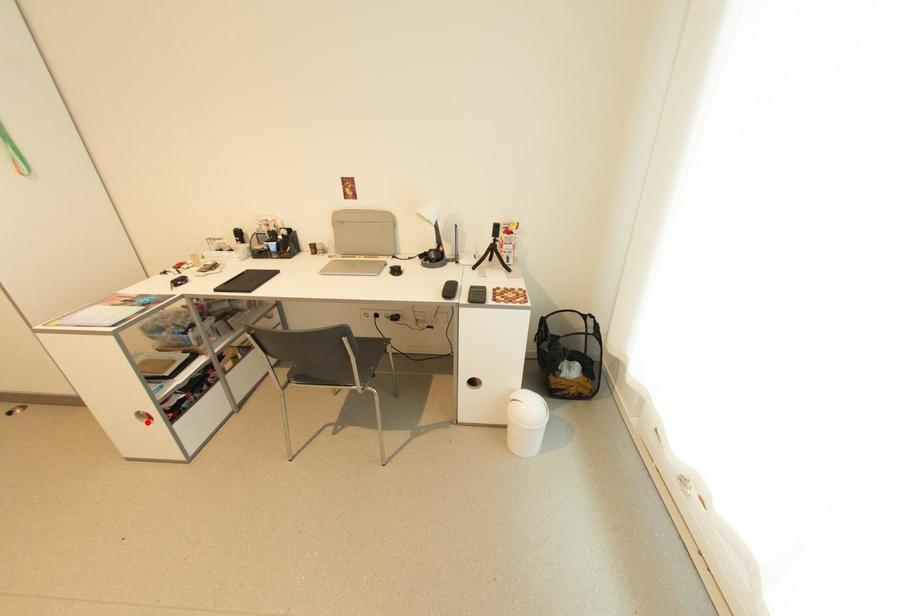
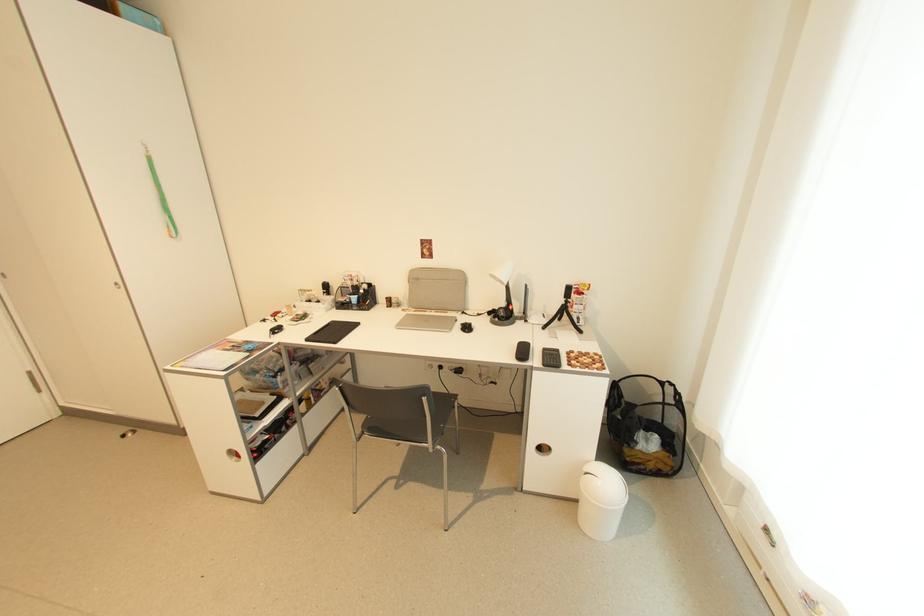
Find the pixel in the second image that matches the highlighted location in the first image.

(237, 460)